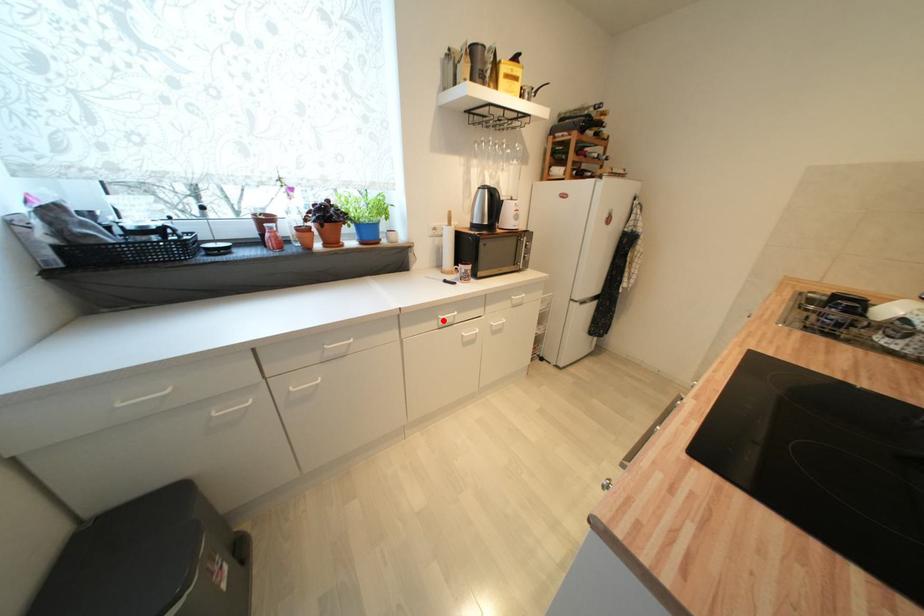
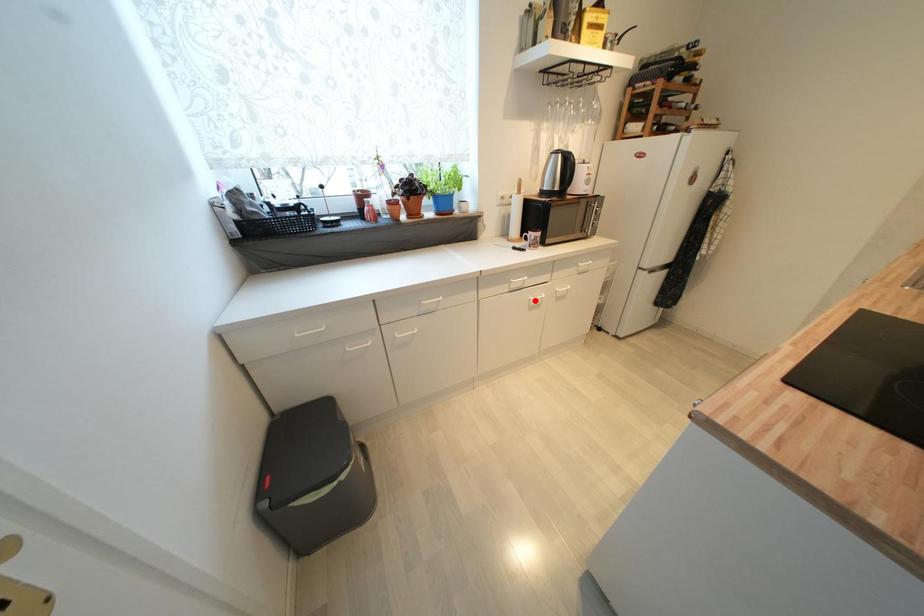
I am providing you with two images of the same scene from different viewpoints. A red point is marked on the first image and another point is marked on the second image. Do the highlighted points in image1 and image2 indicate the same real-world spot?

No